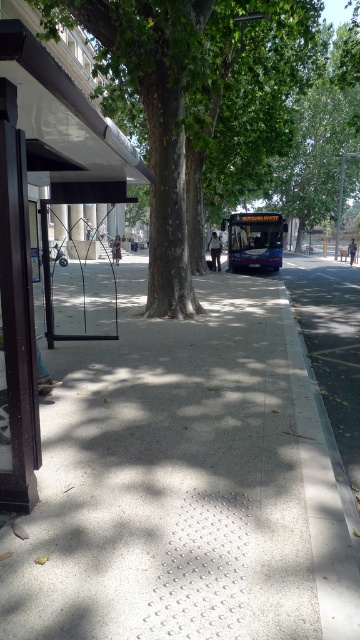
You are standing at the center of the sidewalk and want to reach the black matte bus stop at left. Which direction should you walk to get there?

You should walk to the left to reach the black matte bus stop at left since it is located at point (28, 220), which is to the left side of the image.

You are a visually impaired pedestrian using a cane. You are currently standing on the tactile paving strip at the edge of the sidewalk. You want to walk towards the gray concrete curb at lower right. Which direction should you move relative to the green leafy tree at center?

You should move to the right relative to the green leafy tree at center because the gray concrete curb at lower right is positioned to the right side of the green leafy tree at center.